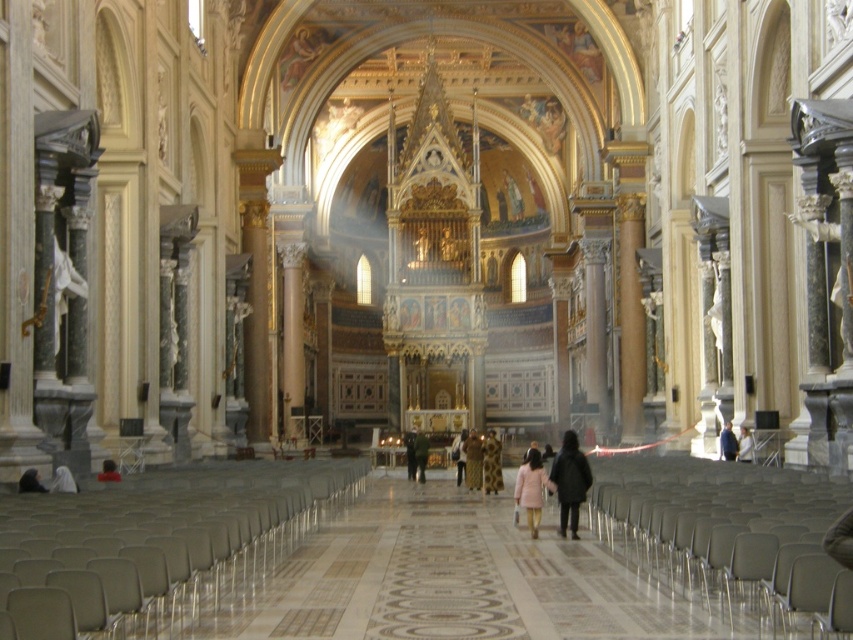
From the picture: Between golden textured statue at center and blue denim jacket at center, which one has more height?

golden textured statue at center

Who is higher up, golden textured statue at center or blue denim jacket at center?

Positioned higher is blue denim jacket at center.

Locate an element on the screen. The image size is (853, 640). golden textured statue at center is located at coordinates (491, 464).

I want to click on golden textured statue at center, so point(491,464).

Based on the photo, does dark brown leather jacket at center appear over white fabric person at center?

No.

Can you confirm if dark brown leather jacket at center is shorter than white fabric person at center?

No.

Locate an element on the screen. The height and width of the screenshot is (640, 853). dark brown leather jacket at center is located at coordinates (421, 454).

Between golden textured statue at center and light brown leather jacket at center, which one appears on the right side from the viewer's perspective?

From the viewer's perspective, golden textured statue at center appears more on the right side.

Can you confirm if golden textured statue at center is positioned below light brown leather jacket at center?

Correct, golden textured statue at center is located below light brown leather jacket at center.

Which is behind, point (495, 480) or point (463, 449)?

The point (463, 449) is behind.

At what (x,y) coordinates should I click in order to perform the action: click on golden textured statue at center. Please return your answer as a coordinate pair (x, y). Looking at the image, I should click on (491, 464).